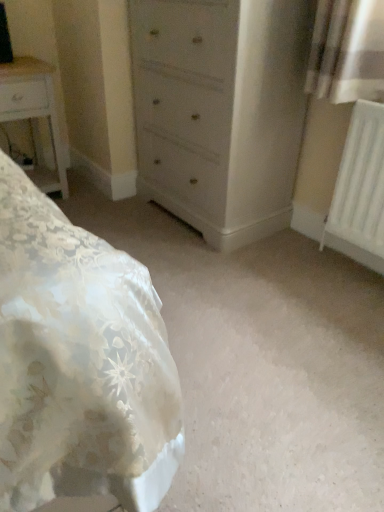
The width and height of the screenshot is (384, 512). In order to click on vacant position to the left of white plastic radiator at right in this screenshot , I will do `click(308, 266)`.